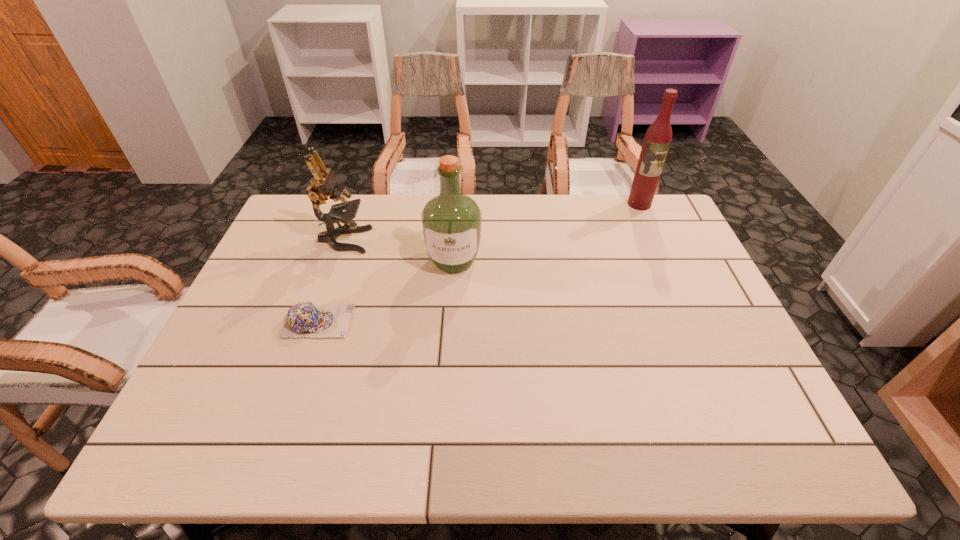
Find the location of a particular element. The height and width of the screenshot is (540, 960). vacant area that satisfies the following two spatial constraints: 1. on the label of the rightmost object; 2. on the front, side, and top of the nearest object is located at coordinates (692, 321).